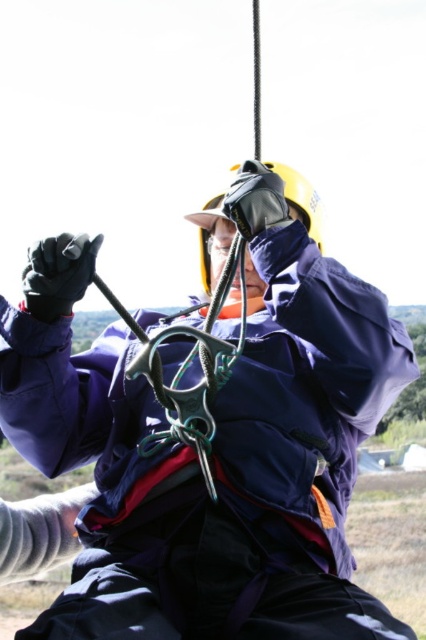
Question: Is navy blue jacket at center further to the viewer compared to yellow matte helmet at center?

Choices:
 (A) no
 (B) yes

Answer: (A)

Question: Does navy blue jacket at center have a greater width compared to yellow matte helmet at center?

Choices:
 (A) yes
 (B) no

Answer: (A)

Question: Which object appears farthest from the camera in this image?

Choices:
 (A) navy blue jacket at center
 (B) yellow matte helmet at center

Answer: (B)

Question: Does navy blue jacket at center appear over yellow matte helmet at center?

Choices:
 (A) no
 (B) yes

Answer: (A)

Question: Which point is farther to the camera?

Choices:
 (A) (201, 241)
 (B) (316, 419)

Answer: (A)